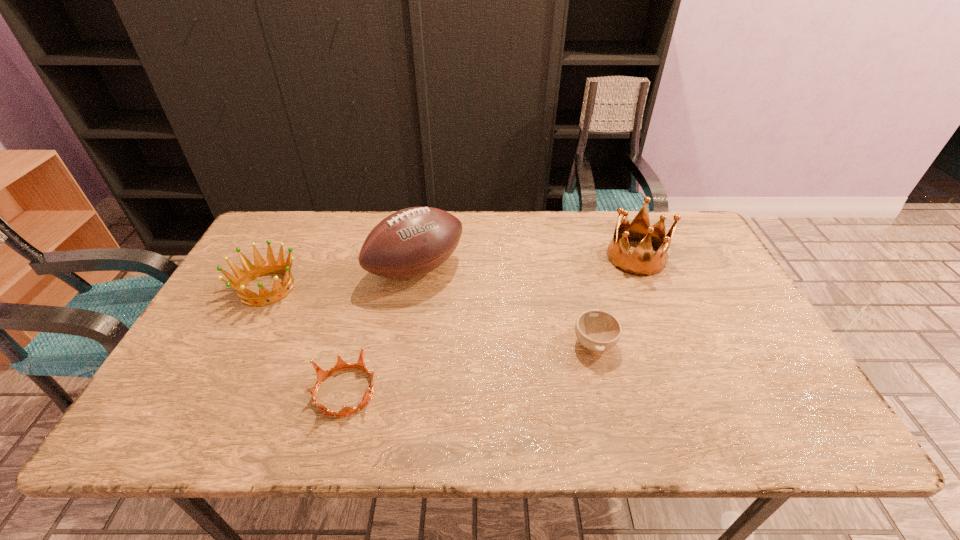
Where is `vacant space that's between the fourth object from left to right and the nearest crown`? vacant space that's between the fourth object from left to right and the nearest crown is located at coordinates coord(469,367).

At what (x,y) coordinates should I click in order to perform the action: click on empty space that is in between the tallest crown and the second shortest crown. Please return your answer as a coordinate pair (x, y). Looking at the image, I should click on (451, 273).

Where is `unoccupied area between the third tallest object and the bowl`? Image resolution: width=960 pixels, height=540 pixels. unoccupied area between the third tallest object and the bowl is located at coordinates (431, 315).

Image resolution: width=960 pixels, height=540 pixels. Find the location of `free space between the rightmost crown and the second shortest crown`. free space between the rightmost crown and the second shortest crown is located at coordinates (451, 273).

The image size is (960, 540). I want to click on object that is the fourth nearest to the bowl, so click(261, 267).

Identify which object is the second nearest to the nearest crown. Please provide its 2D coordinates. Your answer should be formatted as a tuple, i.e. [(x, y)], where the tuple contains the x and y coordinates of a point satisfying the conditions above.

[(411, 242)]

In order to click on crown that stands as the second closest to the football (American) in this screenshot , I will do `click(341, 364)`.

Identify which crown is located as the second nearest to the rightmost crown. Please provide its 2D coordinates. Your answer should be formatted as a tuple, i.e. [(x, y)], where the tuple contains the x and y coordinates of a point satisfying the conditions above.

[(261, 267)]

Locate an element on the screen. Image resolution: width=960 pixels, height=540 pixels. vacant space that satisfies the following two spatial constraints: 1. on the back side of the bowl; 2. on the right side of the second crown from right to left is located at coordinates (358, 343).

I want to click on vacant space that satisfies the following two spatial constraints: 1. on the back side of the second tallest object; 2. on the right side of the bowl, so click(573, 258).